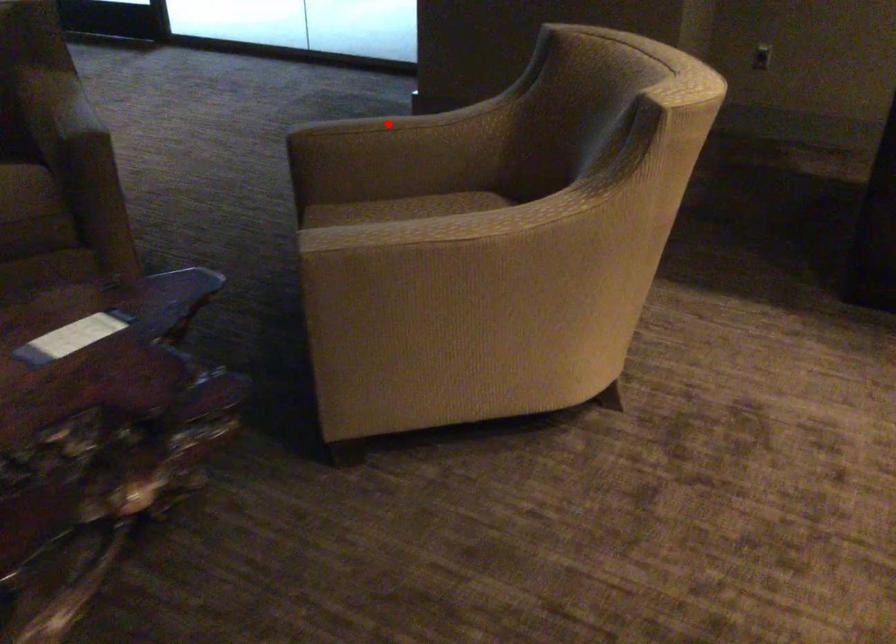
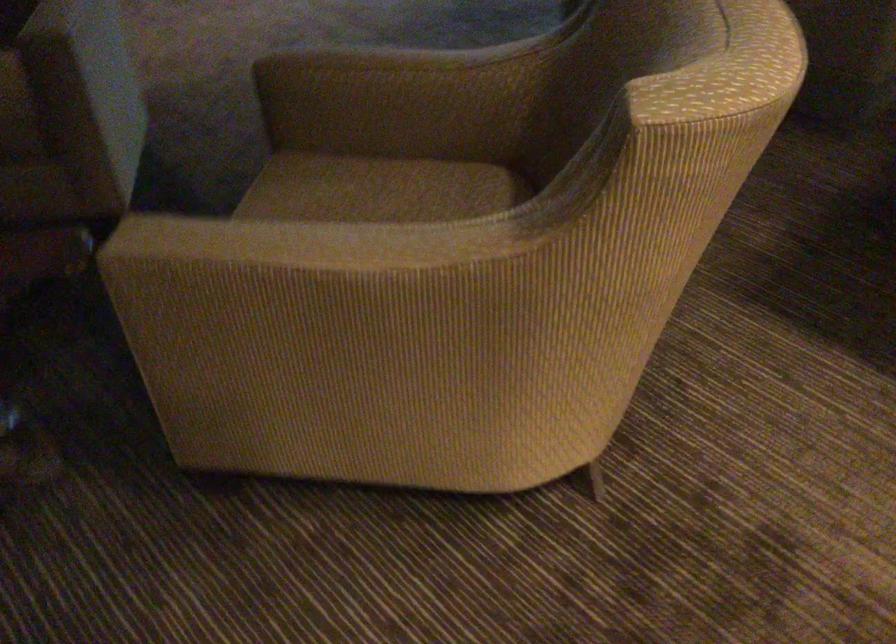
Question: I am providing you with two images of the same scene from different viewpoints. Given a red point in image1, look at the same physical point in image2. Is it:

Choices:
 (A) Closer to the viewpoint
 (B) Farther from the viewpoint

Answer: (A)